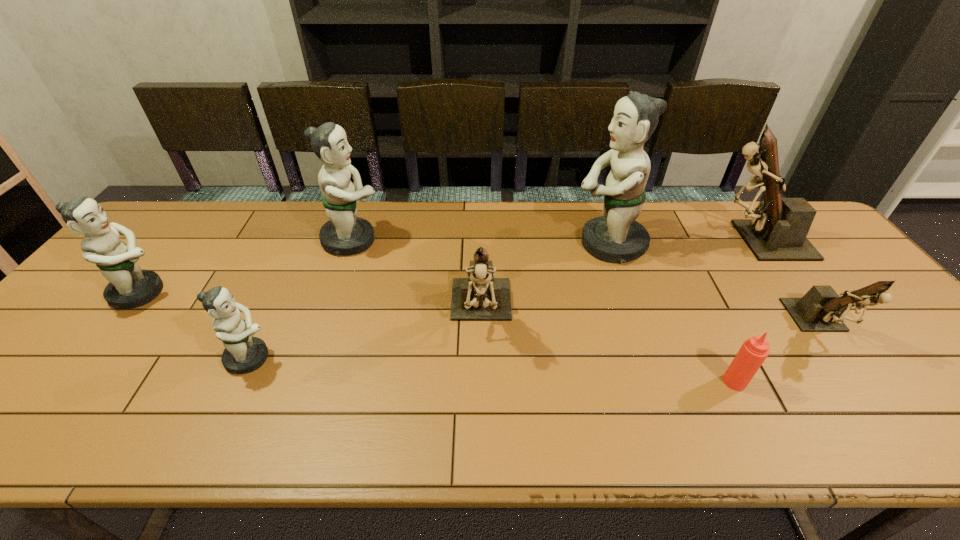
At what (x,y) coordinates should I click in order to perform the action: click on the rightmost green figurine. Please return your answer as a coordinate pair (x, y). The width and height of the screenshot is (960, 540). Looking at the image, I should click on (616, 236).

Where is `the tallest figurine`? the tallest figurine is located at coordinates (616, 236).

Identify the location of the second biggest green figurine. (344, 234).

The height and width of the screenshot is (540, 960). I want to click on the farthest brown figurine, so click(x=778, y=229).

Where is `the third farthest green figurine`? the third farthest green figurine is located at coordinates (129, 286).

Where is `the leftmost green figurine`? This screenshot has height=540, width=960. the leftmost green figurine is located at coordinates (129, 286).

The width and height of the screenshot is (960, 540). I want to click on the second biggest brown figurine, so click(480, 297).

Identify the location of the leftmost brown figurine. The height and width of the screenshot is (540, 960). (480, 297).

Locate an element on the screen. Image resolution: width=960 pixels, height=540 pixels. the smallest brown figurine is located at coordinates (819, 310).

In order to click on the smallest green figurine in this screenshot , I will do `click(243, 353)`.